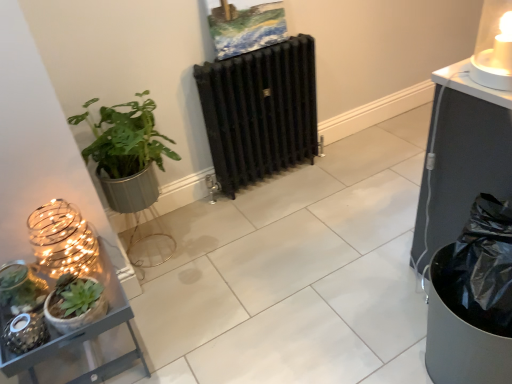
Identify the location of free point above metallic gray shelf at lower left (from a real-world perspective). (38, 295).